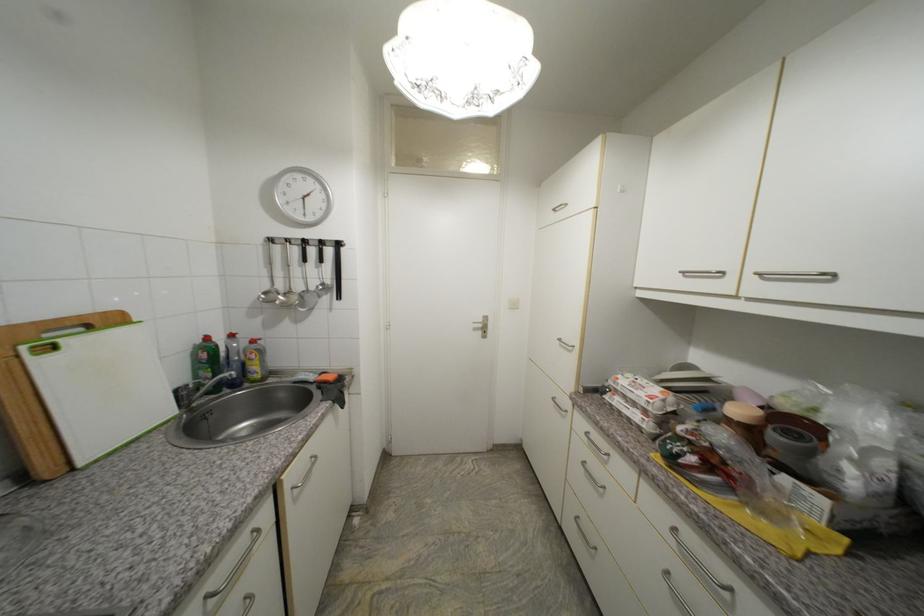
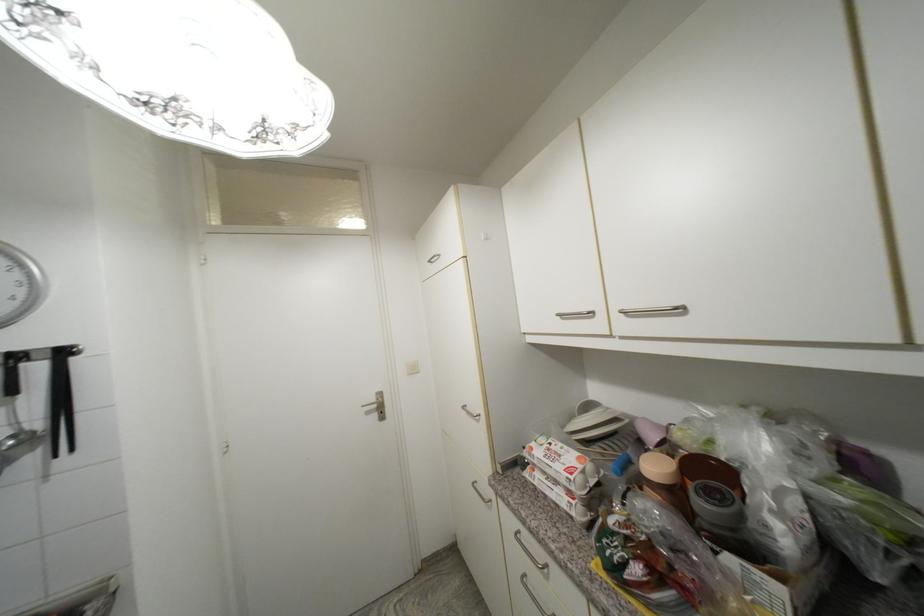
Where in the second image is the point corresponding to pixel 327 244 from the first image?

(22, 359)